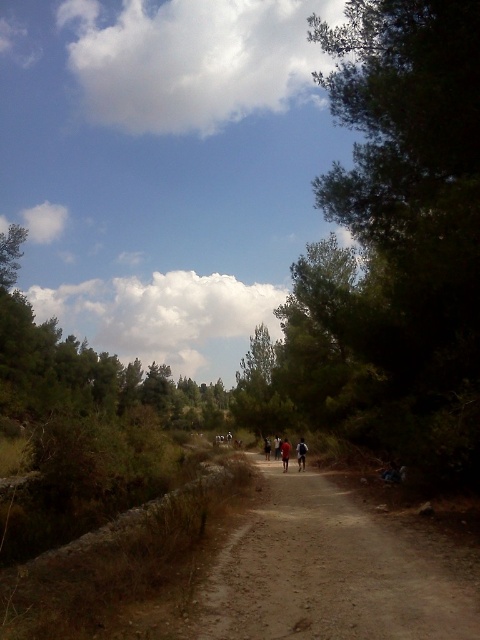
Which is more to the left, dark blue jeans at center or dark blue shirt at center?

Positioned to the left is dark blue shirt at center.

Can you confirm if dark blue jeans at center is positioned to the left of dark blue shirt at center?

In fact, dark blue jeans at center is to the right of dark blue shirt at center.

Does point (287, 461) come in front of point (268, 440)?

Yes, it is in front of point (268, 440).

In order to click on dark blue jeans at center in this screenshot , I will do `click(285, 452)`.

Which is more to the right, dirt path at center or dark blue shirt at center?

dirt path at center

Does point (309, 554) come closer to viewer compared to point (267, 442)?

Yes, point (309, 554) is in front of point (267, 442).

This screenshot has height=640, width=480. I want to click on dirt path at center, so click(x=333, y=572).

Does dark blue fabric at center have a greater width compared to dark blue shirt at center?

Yes.

Does dark blue fabric at center have a smaller size compared to dark blue shirt at center?

No.

At what (x,y) coordinates should I click in order to perform the action: click on dark blue fabric at center. Please return your answer as a coordinate pair (x, y). Image resolution: width=480 pixels, height=640 pixels. Looking at the image, I should click on (300, 454).